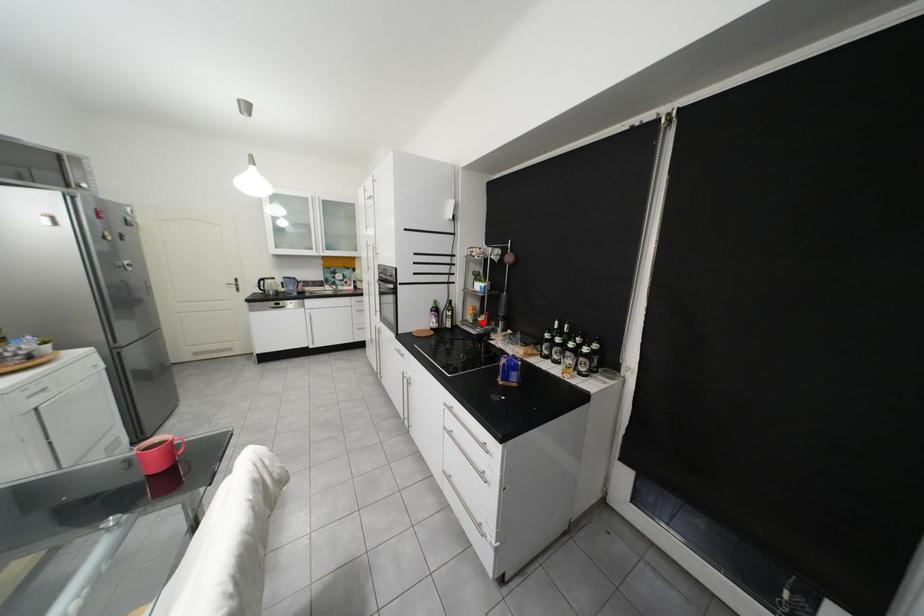
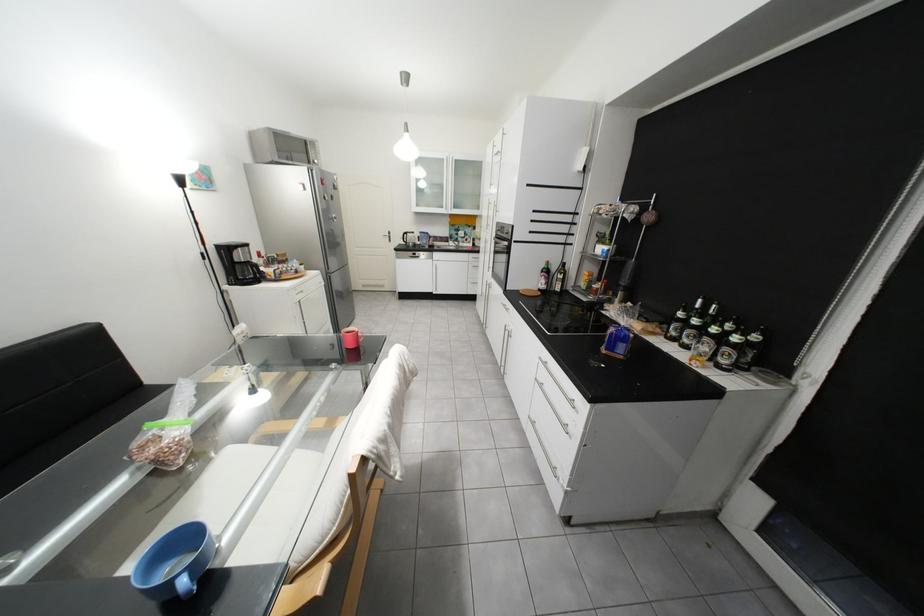
Locate, in the second image, the point that corresponds to the highlighted location in the first image.

(596, 288)